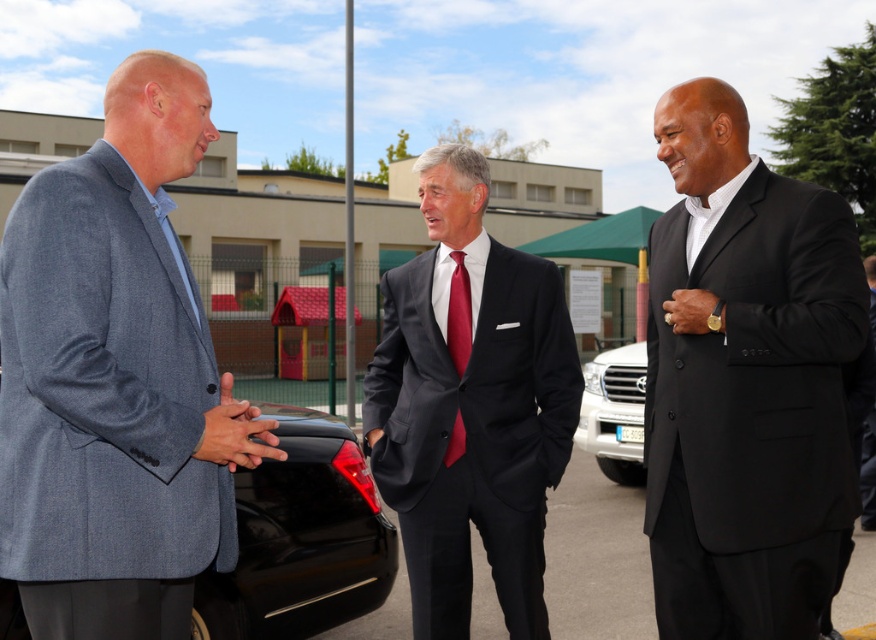
Between gray wool blazer at left and white metallic suv at center, which one appears on the right side from the viewer's perspective?

From the viewer's perspective, white metallic suv at center appears more on the right side.

Can you confirm if gray wool blazer at left is shorter than white metallic suv at center?

No, gray wool blazer at left is not shorter than white metallic suv at center.

This screenshot has width=876, height=640. Describe the element at coordinates (115, 378) in the screenshot. I see `gray wool blazer at left` at that location.

Identify the location of gray wool blazer at left. (115, 378).

Is point (672, 104) closer to camera compared to point (629, 365)?

Yes, it is.

Between point (690, 314) and point (634, 378), which one is positioned behind?

The point (634, 378) is behind.

Locate an element on the screen. Image resolution: width=876 pixels, height=640 pixels. black smooth suit at right is located at coordinates (745, 381).

Can you confirm if gray wool blazer at left is smaller than matte black suit at center?

Incorrect, gray wool blazer at left is not smaller in size than matte black suit at center.

Is point (41, 426) less distant than point (471, 480)?

That is True.

Find the location of a particular element. This screenshot has height=640, width=876. gray wool blazer at left is located at coordinates pyautogui.click(x=115, y=378).